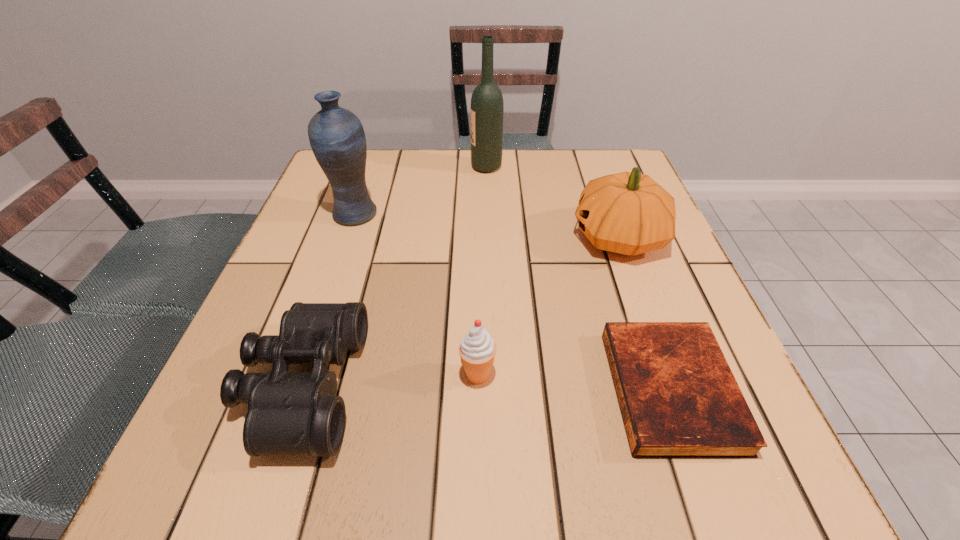
I want to click on free space that is in between the Bible and the binoculars, so click(x=487, y=388).

Where is `unoccupied area between the icecream and the shortest object`? The image size is (960, 540). unoccupied area between the icecream and the shortest object is located at coordinates click(x=574, y=382).

At what (x,y) coordinates should I click in order to perform the action: click on object that stands as the closest to the fourth shortest object. Please return your answer as a coordinate pair (x, y). Looking at the image, I should click on (678, 397).

Locate which object ranks in proximity to the Bible. Please provide its 2D coordinates. Your answer should be formatted as a tuple, i.e. [(x, y)], where the tuple contains the x and y coordinates of a point satisfying the conditions above.

[(628, 213)]

The width and height of the screenshot is (960, 540). Find the location of `vacant space that satisfies the following two spatial constraints: 1. on the front side of the icecream; 2. on the left side of the vase`. vacant space that satisfies the following two spatial constraints: 1. on the front side of the icecream; 2. on the left side of the vase is located at coordinates (300, 375).